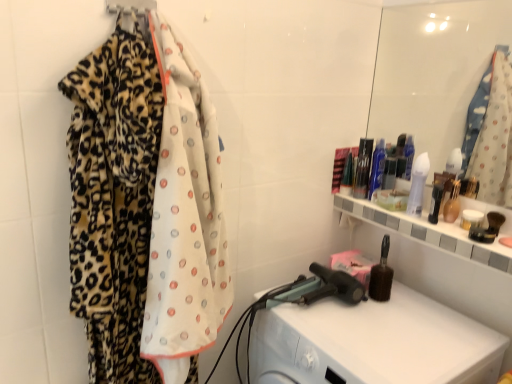
Image resolution: width=512 pixels, height=384 pixels. What are the coordinates of `blank space situated above white plastic washing machine at lower right (from a real-world perspective)` in the screenshot? It's located at (369, 327).